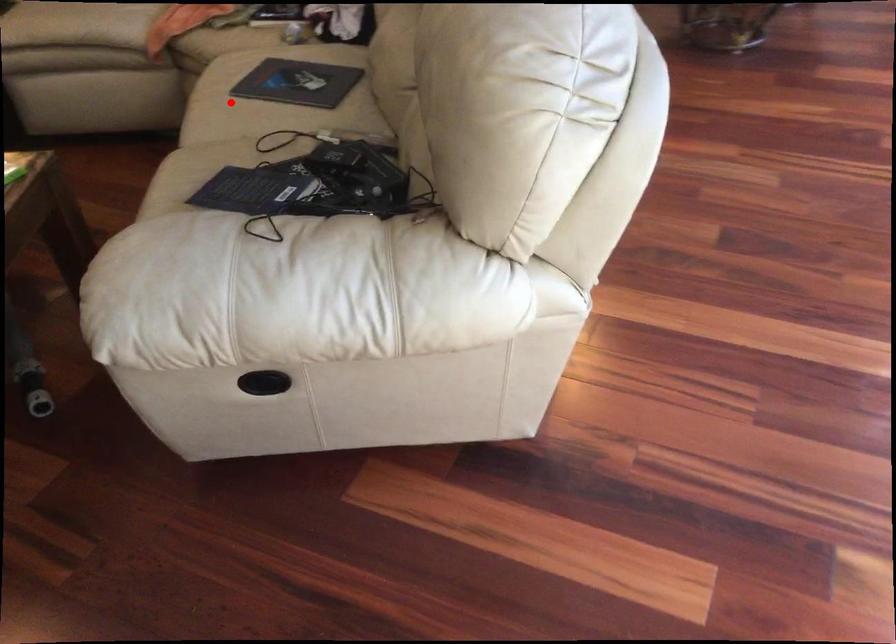
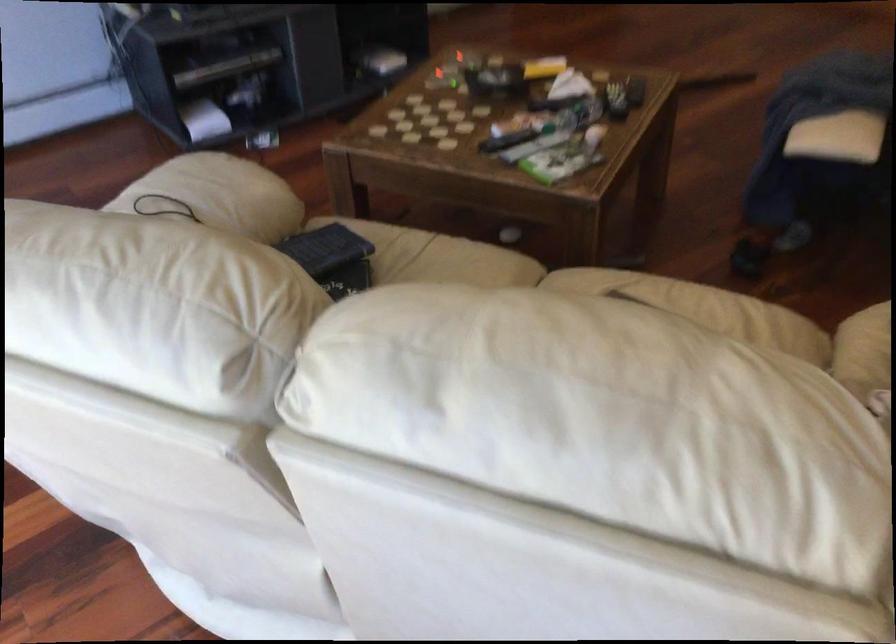
In the second image, find the point that corresponds to the highlighted location in the first image.

(584, 285)